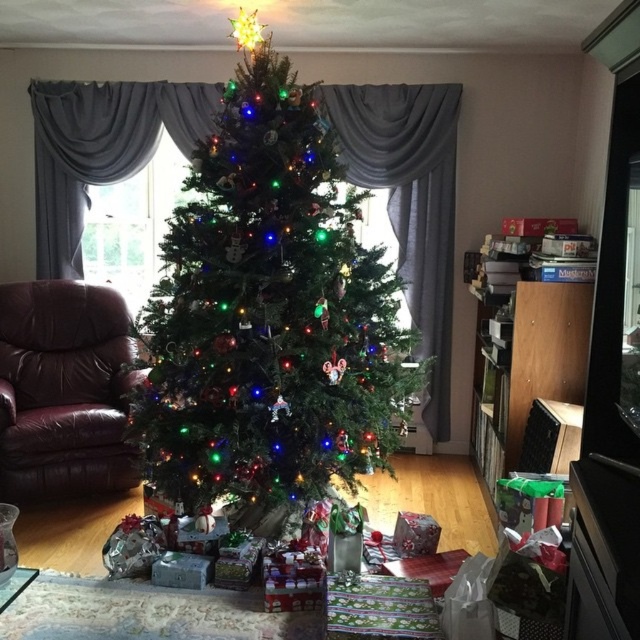
Who is taller, green matte christmas tree at center or leather armchair at left?

Standing taller between the two is green matte christmas tree at center.

Is green matte christmas tree at center positioned behind leather armchair at left?

No, green matte christmas tree at center is in front of leather armchair at left.

Does point (177, 230) come farther from viewer compared to point (10, 406)?

That is False.

This screenshot has height=640, width=640. I want to click on green matte christmas tree at center, so click(268, 310).